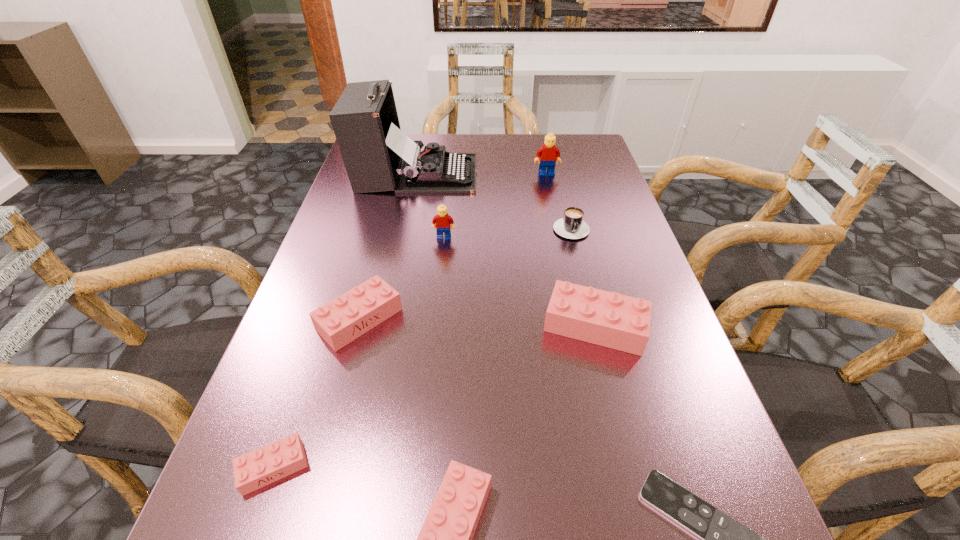
Find the location of a particular element. the shortest Lego is located at coordinates (256, 469).

Where is `free spot located inside the open case of the typewriter`? The height and width of the screenshot is (540, 960). free spot located inside the open case of the typewriter is located at coordinates (582, 173).

You are a GUI agent. You are given a task and a screenshot of the screen. Output one action in this format:
    pyautogui.click(x=<x>, y=<y>)
    Task: Click on the vacant space situated on the front-facing side of the tallest Lego
    This screenshot has width=960, height=540.
    Given the screenshot: What is the action you would take?
    pyautogui.click(x=554, y=208)

The width and height of the screenshot is (960, 540). I want to click on vacant space positioned 0.300m on the front-facing side of the nearer yellow Lego, so click(434, 341).

You are a GUI agent. You are given a task and a screenshot of the screen. Output one action in this format:
    pyautogui.click(x=<x>, y=<y>)
    Task: Click on the free space located 0.190m on the left of the third tallest Lego
    The height and width of the screenshot is (540, 960).
    Given the screenshot: What is the action you would take?
    pyautogui.click(x=444, y=326)

The width and height of the screenshot is (960, 540). What are the coordinates of `vacant point located 0.370m on the back of the third shortest Lego` in the screenshot? It's located at (393, 194).

Identify the location of vacant area situated 0.330m with the handle on the side of the cappuccino. 603,355.

Image resolution: width=960 pixels, height=540 pixels. Identify the location of vacant area situated 0.340m on the back of the smallest pink Lego. (336, 286).

Where is `typewriter located in the far edge section of the desktop`? This screenshot has width=960, height=540. typewriter located in the far edge section of the desktop is located at coordinates (378, 156).

Identify the location of Lego that is at the far edge. (549, 154).